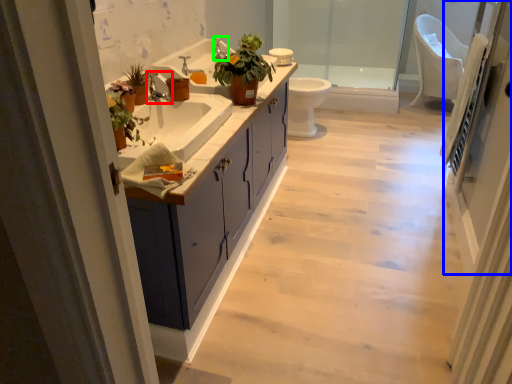
Question: Based on their relative distances, which object is farther from faucet (highlighted by a red box)? Choose from screen door (highlighted by a blue box) and faucet (highlighted by a green box).

Choices:
 (A) screen door
 (B) faucet

Answer: (A)